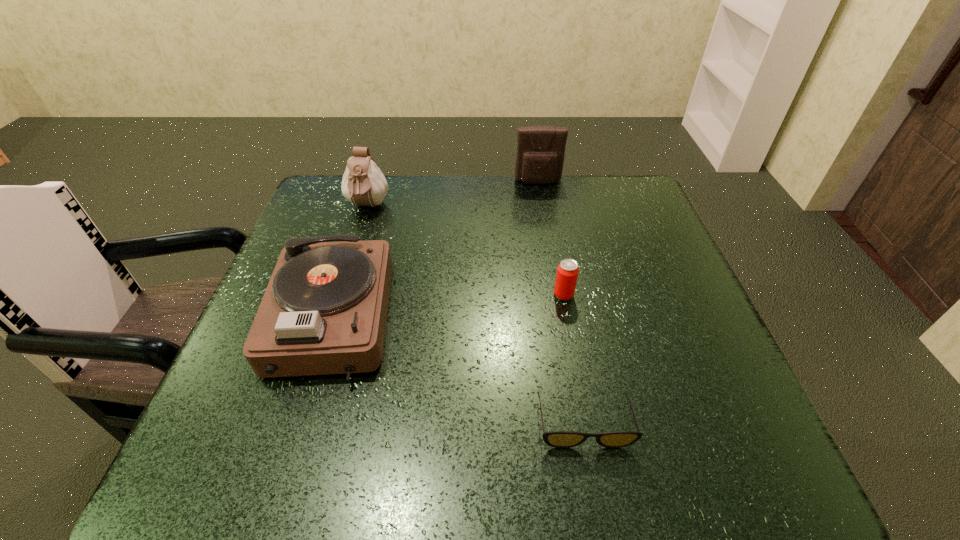
Locate an element on the screen. The image size is (960, 540). empty location between the nearest object and the fourth tallest object is located at coordinates (574, 359).

The height and width of the screenshot is (540, 960). In order to click on object that ranks as the fourth closest to the record player in this screenshot , I will do `click(540, 149)`.

Point out which object is positioned as the second nearest to the nearest object. Please provide its 2D coordinates. Your answer should be formatted as a tuple, i.e. [(x, y)], where the tuple contains the x and y coordinates of a point satisfying the conditions above.

[(324, 311)]

The image size is (960, 540). Find the location of `vacant position in the image that satisfies the following two spatial constraints: 1. on the front-facing side of the nearer pouch; 2. on the left side of the second shortest object`. vacant position in the image that satisfies the following two spatial constraints: 1. on the front-facing side of the nearer pouch; 2. on the left side of the second shortest object is located at coordinates (339, 295).

Image resolution: width=960 pixels, height=540 pixels. I want to click on vacant position in the image that satisfies the following two spatial constraints: 1. with an open flap on the fourth tallest object; 2. on the right side of the right pouch, so click(x=558, y=295).

In order to click on free space in the image that satisfies the following two spatial constraints: 1. on the front-facing side of the beer can; 2. on the right side of the fourth nearest object in this screenshot , I will do `click(339, 295)`.

Locate an element on the screen. vacant region that satisfies the following two spatial constraints: 1. with an open flap on the fourth tallest object; 2. on the right side of the farther pouch is located at coordinates (558, 295).

The width and height of the screenshot is (960, 540). What are the coordinates of `vacant space that satisfies the following two spatial constraints: 1. with an open flap on the beer can; 2. on the left side of the farther pouch` in the screenshot? It's located at (558, 295).